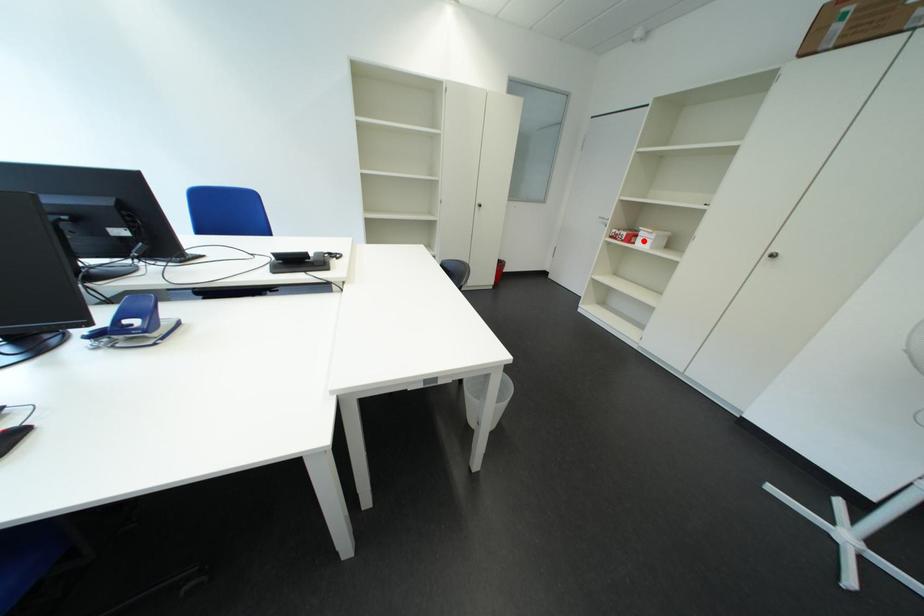
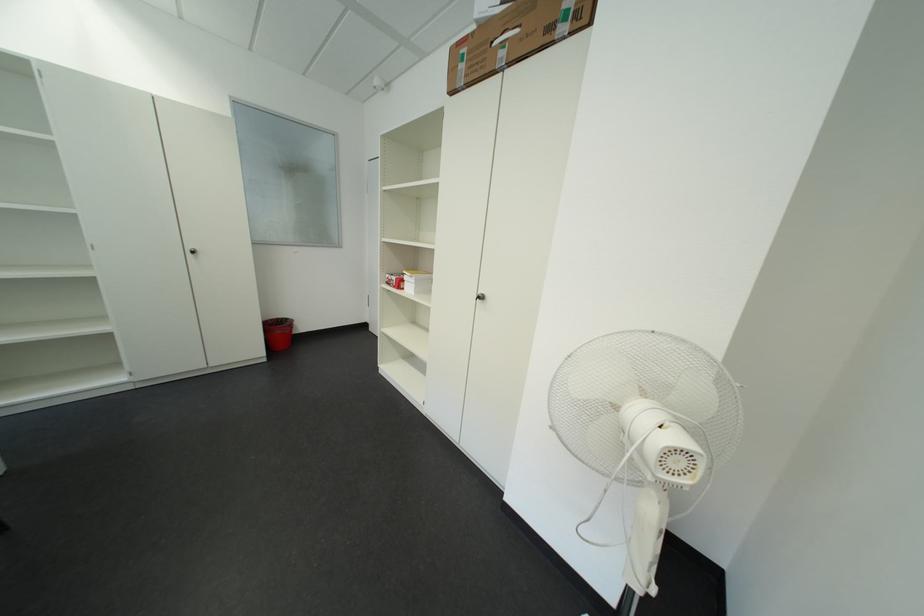
The point at the highlighted location is marked in the first image. Where is the corresponding point in the second image?

(411, 286)